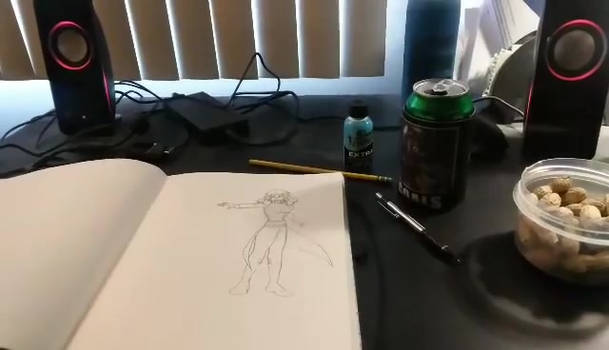
Identify the location of speakers. This screenshot has width=609, height=350. (x=569, y=107), (x=90, y=76).